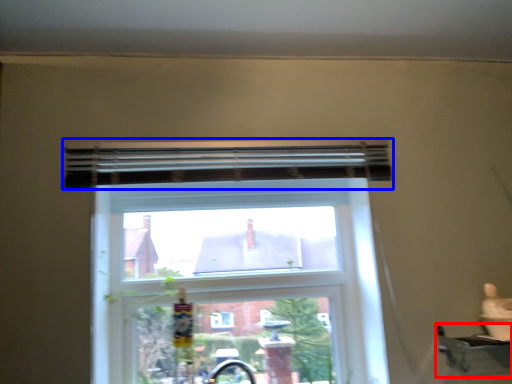
Question: Which of the following is the farthest to the observer, window sill (highlighted by a red box) or curtain (highlighted by a blue box)?

Choices:
 (A) window sill
 (B) curtain

Answer: (B)